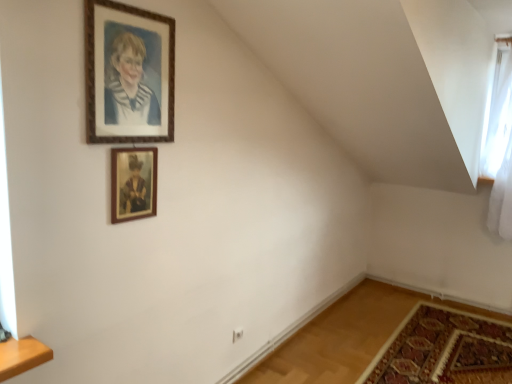
Question: Would you say carpeted mat at lower right is to the left or to the right of wooden picture frame at upper center, the first picture frame from the bottom, in the picture?

Choices:
 (A) left
 (B) right

Answer: (B)

Question: Based on their sizes in the image, would you say carpeted mat at lower right is bigger or smaller than wooden picture frame at upper center, the 2th picture frame positioned from the top?

Choices:
 (A) small
 (B) big

Answer: (B)

Question: Considering the real-world distances, which object is closest to the wooden picture frame at upper center, the first picture frame from the bottom?

Choices:
 (A) carpeted mat at lower right
 (B) white sheer curtain at upper right
 (C) wooden frame at upper center, the 2th picture frame from the bottom

Answer: (C)

Question: Estimate the real-world distances between objects in this image. Which object is closer to the wooden frame at upper center, the 2th picture frame from the bottom?

Choices:
 (A) carpeted mat at lower right
 (B) white sheer curtain at upper right
 (C) wooden picture frame at upper center, the first picture frame from the bottom

Answer: (C)